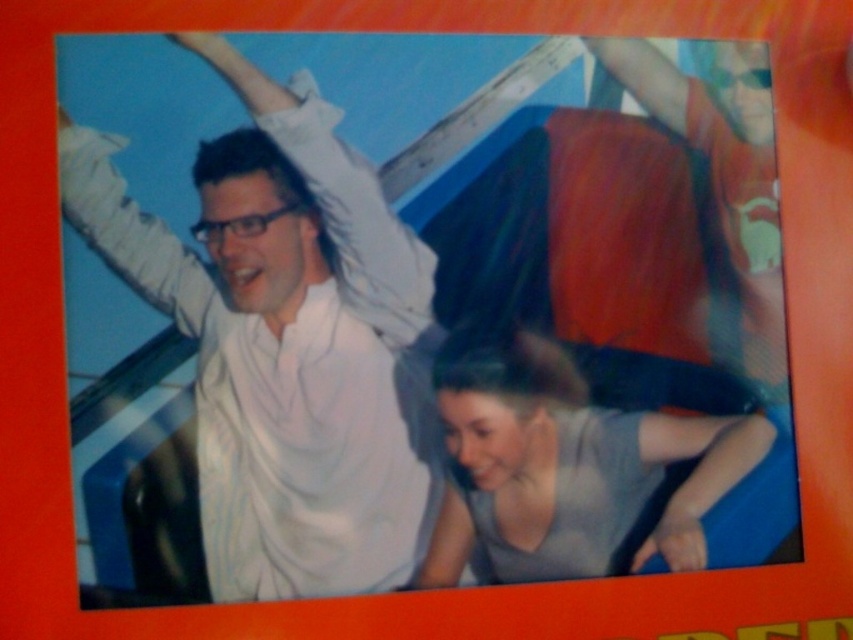
Question: Which object appears closest to the camera in this image?

Choices:
 (A) white cotton shirt at upper left
 (B) gray matte shirt at lower center

Answer: (A)

Question: Does white matte shirt at upper left appear under smooth skin arm at lower right?

Choices:
 (A) no
 (B) yes

Answer: (A)

Question: Which of the following is the farthest from the observer?

Choices:
 (A) (132, 291)
 (B) (469, 556)

Answer: (B)

Question: Can you confirm if white cotton shirt at upper left is positioned below smooth red arm at upper right?

Choices:
 (A) no
 (B) yes

Answer: (B)

Question: Among these points, which one is farthest from the camera?

Choices:
 (A) (701, 508)
 (B) (453, 388)
 (C) (126, 243)
 (D) (646, 112)

Answer: (D)

Question: Is smooth skin arm at lower right in front of smooth red arm at upper right?

Choices:
 (A) yes
 (B) no

Answer: (A)